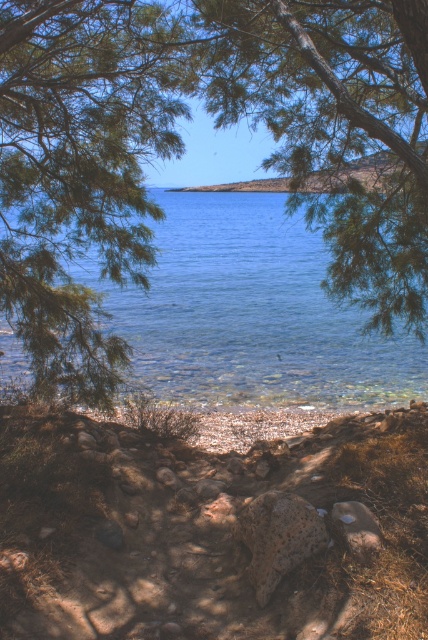
Question: Which of these objects is positioned farthest from the brown rough stone at center?

Choices:
 (A) green leafy tree at left
 (B) speckled rock at lower center
 (C) green leafy tree at center
 (D) clear blue water at center

Answer: (D)

Question: Is green leafy tree at left positioned behind speckled rock at lower center?

Choices:
 (A) yes
 (B) no

Answer: (A)

Question: Can you confirm if clear blue water at center is thinner than speckled rock at lower center?

Choices:
 (A) yes
 (B) no

Answer: (B)

Question: Which of the following is the closest to the observer?

Choices:
 (A) speckled rock at lower center
 (B) green leafy tree at center

Answer: (A)

Question: Does green leafy tree at center come in front of speckled rock at lower center?

Choices:
 (A) yes
 (B) no

Answer: (B)

Question: Which is farther from the brown rough stone at center?

Choices:
 (A) clear blue water at center
 (B) green leafy tree at center
 (C) speckled rock at lower center

Answer: (A)